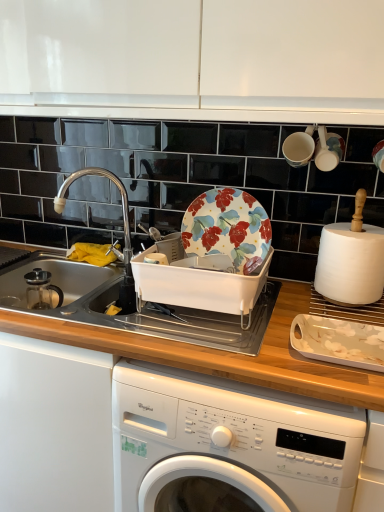
Question: Does white glossy washing machine at lower center have a lesser height compared to white glossy platter at lower right?

Choices:
 (A) yes
 (B) no

Answer: (B)

Question: Is white glossy washing machine at lower center not inside white glossy platter at lower right?

Choices:
 (A) yes
 (B) no

Answer: (A)

Question: From a real-world perspective, is white glossy washing machine at lower center below white glossy platter at lower right?

Choices:
 (A) no
 (B) yes

Answer: (B)

Question: Could you tell me if white glossy washing machine at lower center is turned towards white glossy platter at lower right?

Choices:
 (A) yes
 (B) no

Answer: (B)

Question: Is white glossy washing machine at lower center far from white glossy platter at lower right?

Choices:
 (A) no
 (B) yes

Answer: (A)

Question: Is white glossy washing machine at lower center to the right of white glossy platter at lower right from the viewer's perspective?

Choices:
 (A) no
 (B) yes

Answer: (A)

Question: Is white glossy washing machine at lower center to the left of floral ceramic plate at center from the viewer's perspective?

Choices:
 (A) no
 (B) yes

Answer: (A)

Question: Does white glossy washing machine at lower center have a greater width compared to floral ceramic plate at center?

Choices:
 (A) no
 (B) yes

Answer: (B)

Question: From the image's perspective, is white glossy washing machine at lower center above floral ceramic plate at center?

Choices:
 (A) no
 (B) yes

Answer: (A)

Question: Does white glossy washing machine at lower center have a smaller size compared to floral ceramic plate at center?

Choices:
 (A) yes
 (B) no

Answer: (B)

Question: Considering the relative sizes of white glossy washing machine at lower center and floral ceramic plate at center in the image provided, is white glossy washing machine at lower center bigger than floral ceramic plate at center?

Choices:
 (A) no
 (B) yes

Answer: (B)

Question: Is white glossy washing machine at lower center looking in the opposite direction of floral ceramic plate at center?

Choices:
 (A) yes
 (B) no

Answer: (B)

Question: From a real-world perspective, is white glossy cabinet at upper center positioned over white matte paper towel at right based on gravity?

Choices:
 (A) no
 (B) yes

Answer: (B)